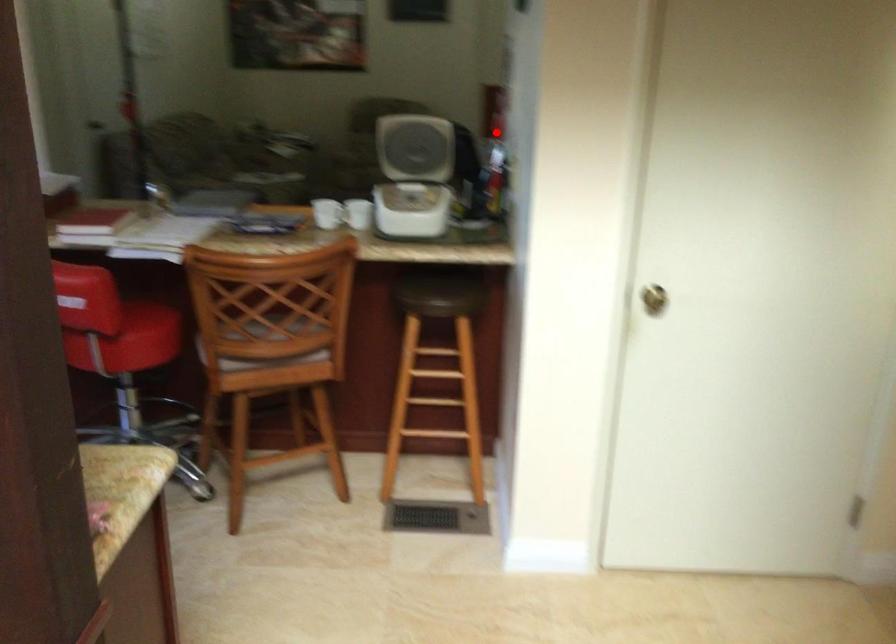
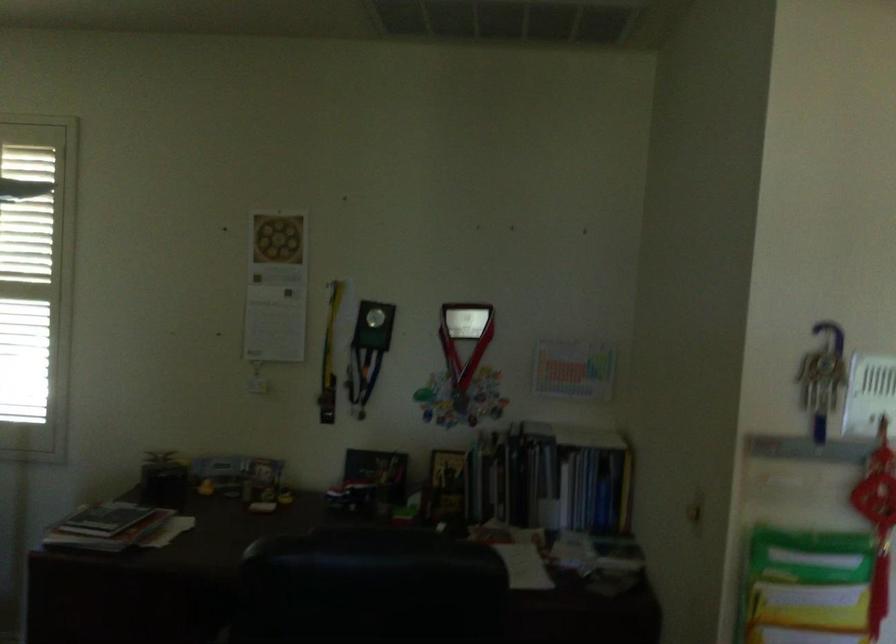
In the second image, find the point that corresponds to the highlighted location in the first image.

(877, 522)